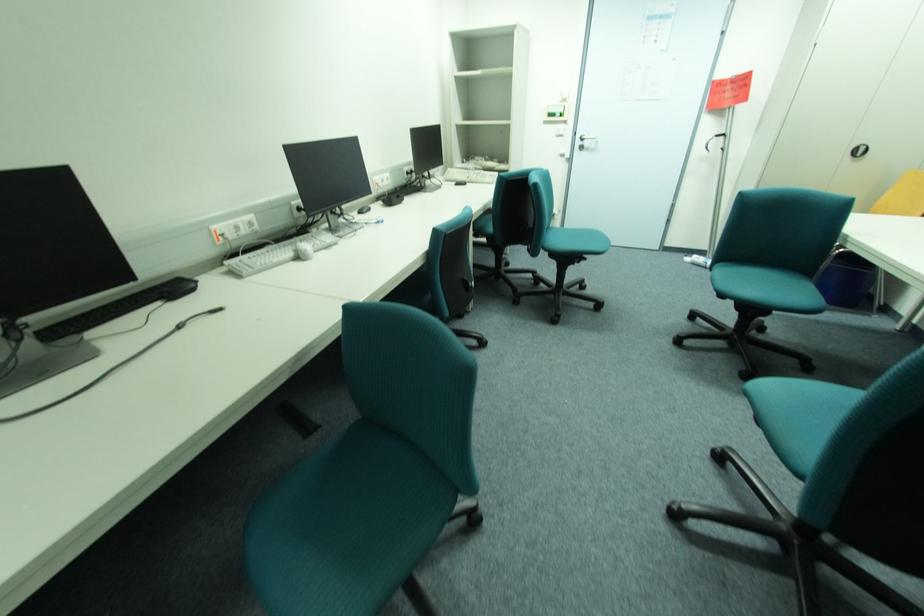
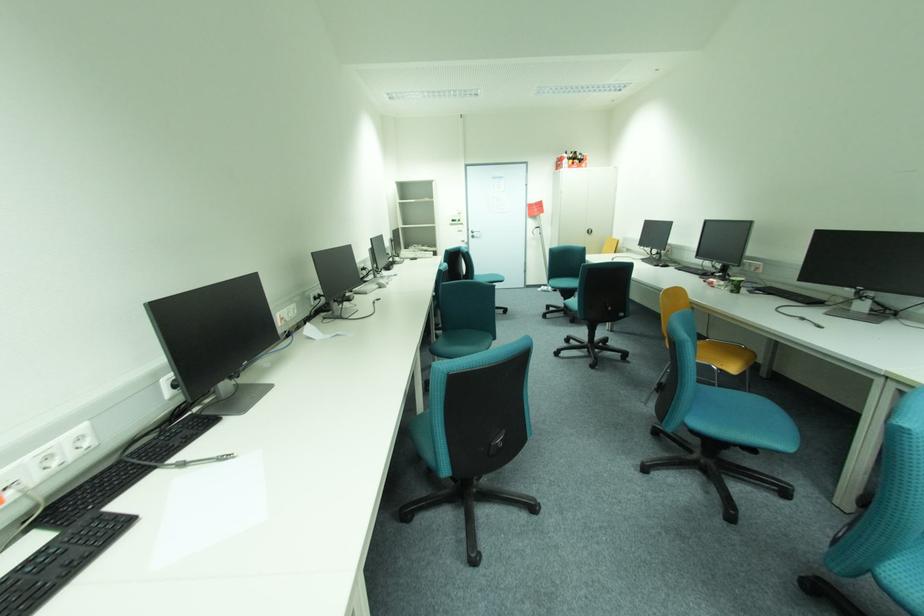
Locate, in the second image, the point that corresponds to point 585,144 in the first image.

(477, 235)